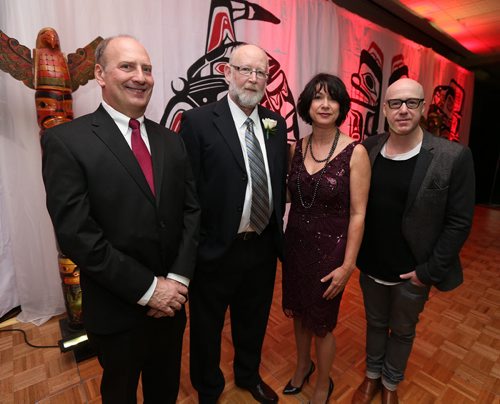
Find the location of a particular element. This screenshot has height=404, width=500. ceiling is located at coordinates (410, 6), (467, 9), (467, 36), (482, 30), (424, 25).